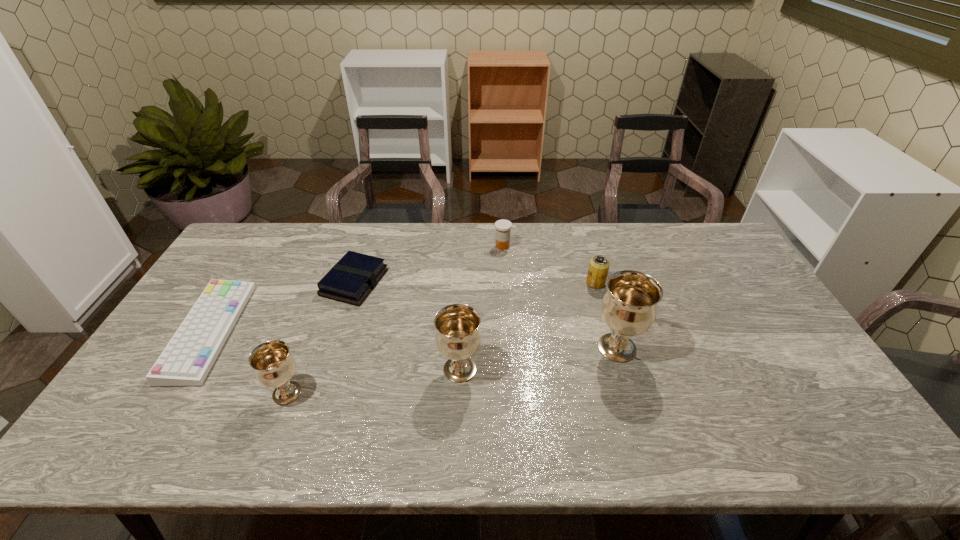
Identify the location of free space between the tallest object and the book. Image resolution: width=960 pixels, height=540 pixels. (486, 315).

Where is `free spot between the fourth object from right to left and the book`? free spot between the fourth object from right to left and the book is located at coordinates (407, 326).

The height and width of the screenshot is (540, 960). Identify the location of free space between the medicine and the beer can. (549, 265).

Identify the location of vacant area between the shortest chalice and the fifth object from left to right. This screenshot has height=540, width=960. (395, 320).

At what (x,y) coordinates should I click in order to perform the action: click on vacant space that is in between the third object from right to left and the tallest chalice. Please return your answer as a coordinate pair (x, y). Looking at the image, I should click on (560, 297).

This screenshot has height=540, width=960. In order to click on vacant space that is in between the computer keyboard and the third tallest object in this screenshot , I will do `click(249, 362)`.

This screenshot has width=960, height=540. I want to click on vacant space in between the medicine and the book, so click(x=428, y=264).

You are a GUI agent. You are given a task and a screenshot of the screen. Output one action in this format:
    pyautogui.click(x=<x>, y=<y>)
    Task: Click on the free space between the farthest object and the beer can
    
    Given the screenshot: What is the action you would take?
    pyautogui.click(x=549, y=265)

Point out which object is positioned as the third nearest to the medicine. Please provide its 2D coordinates. Your answer should be formatted as a tuple, i.e. [(x, y)], where the tuple contains the x and y coordinates of a point satisfying the conditions above.

[(629, 307)]

Locate an element on the screen. object that is the fifth nearest to the computer keyboard is located at coordinates (629, 307).